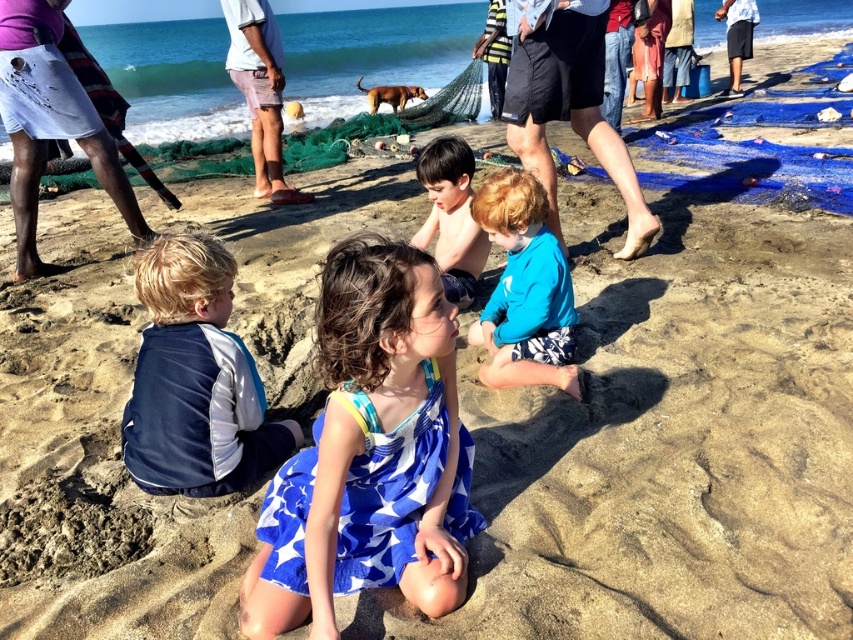
Question: Does blue cotton dress at center lie behind dark blue shorts at center?

Choices:
 (A) no
 (B) yes

Answer: (A)

Question: Can you confirm if blue/white fabric vest at left is positioned to the right of light brown shorts at upper center?

Choices:
 (A) yes
 (B) no

Answer: (A)

Question: Which of the following is the closest to the observer?

Choices:
 (A) (296, 429)
 (B) (531, 140)

Answer: (A)

Question: Which point is closer to the camera taking this photo?

Choices:
 (A) pyautogui.click(x=552, y=372)
 (B) pyautogui.click(x=32, y=204)
 (C) pyautogui.click(x=231, y=4)

Answer: (A)

Question: Can you confirm if blue fabric at center is wider than shiny blue shorts at center?

Choices:
 (A) no
 (B) yes

Answer: (B)

Question: Estimate the real-world distances between objects in this image. Which object is closer to the dark blue shorts at upper right?

Choices:
 (A) dark blue shorts at center
 (B) blue fabric at center
 (C) blue/white fabric vest at left

Answer: (A)